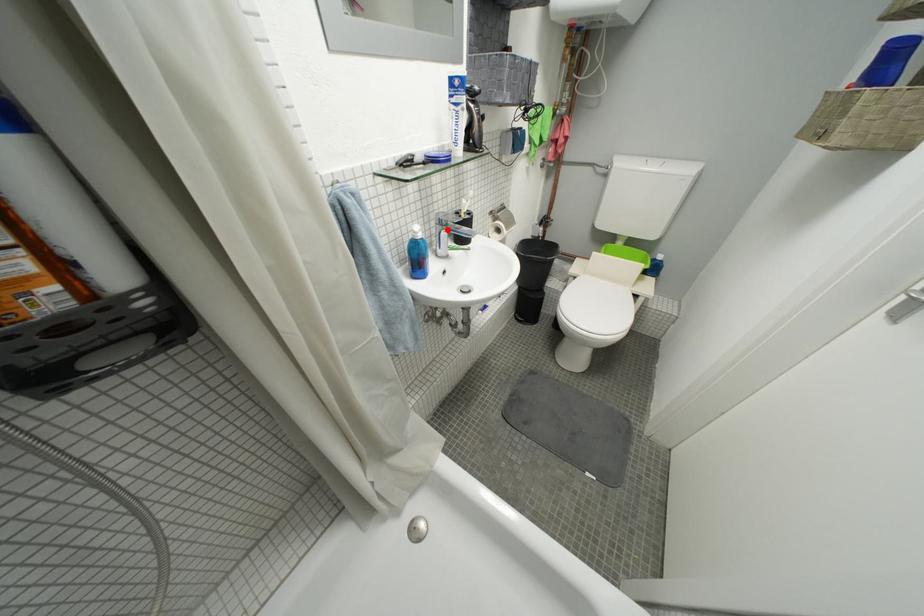
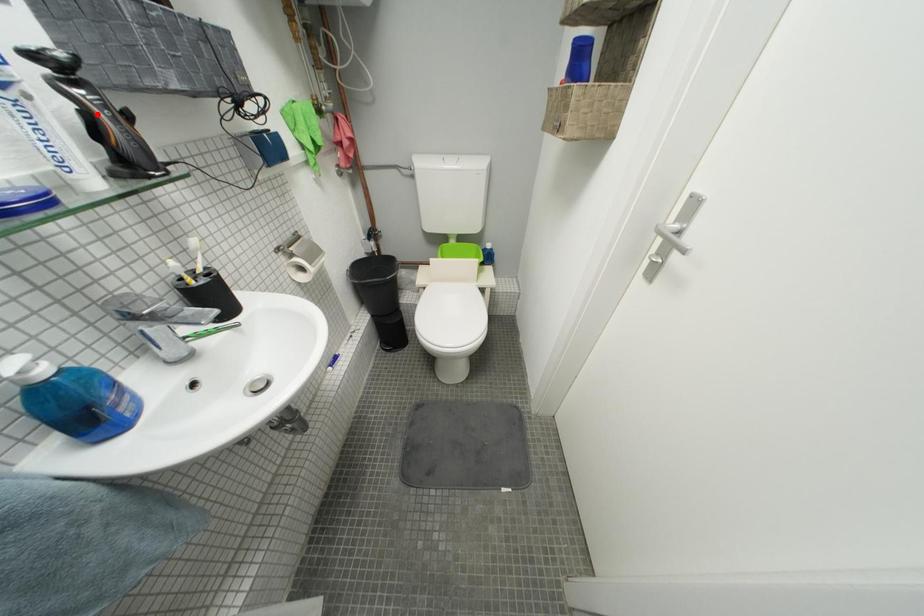
I am providing you with two images of the same scene from different viewpoints. A red point is marked on the first image and another point is marked on the second image. Do the highlighted points in image1 and image2 indicate the same real-world spot?

No